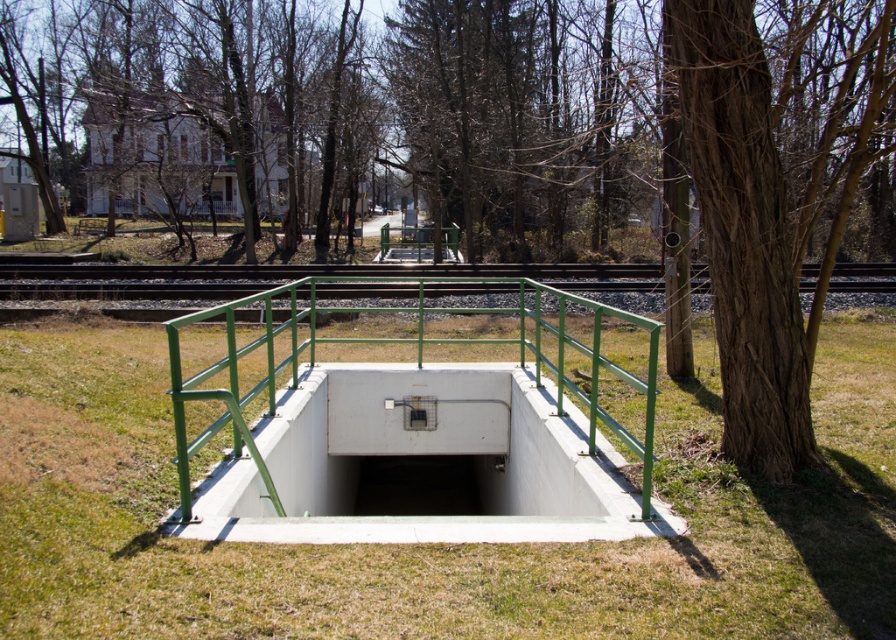
Question: Which object is the farthest from the green metal train track at center?

Choices:
 (A) white concrete rail at center
 (B) green grass at center
 (C) white concrete hole at center

Answer: (C)

Question: Does green metal train track at center appear on the right side of white concrete hole at center?

Choices:
 (A) no
 (B) yes

Answer: (B)

Question: Which point is closer to the camera?

Choices:
 (A) (263, 280)
 (B) (894, 436)
 (C) (410, 428)
 (D) (169, 346)

Answer: (D)

Question: Can you confirm if white concrete rail at center is bigger than green metal train track at center?

Choices:
 (A) yes
 (B) no

Answer: (A)

Question: Can you confirm if green metal train track at center is positioned below white concrete hole at center?

Choices:
 (A) yes
 (B) no

Answer: (B)

Question: Which point is closer to the camera taking this photo?

Choices:
 (A) (55, 268)
 (B) (277, 518)

Answer: (B)